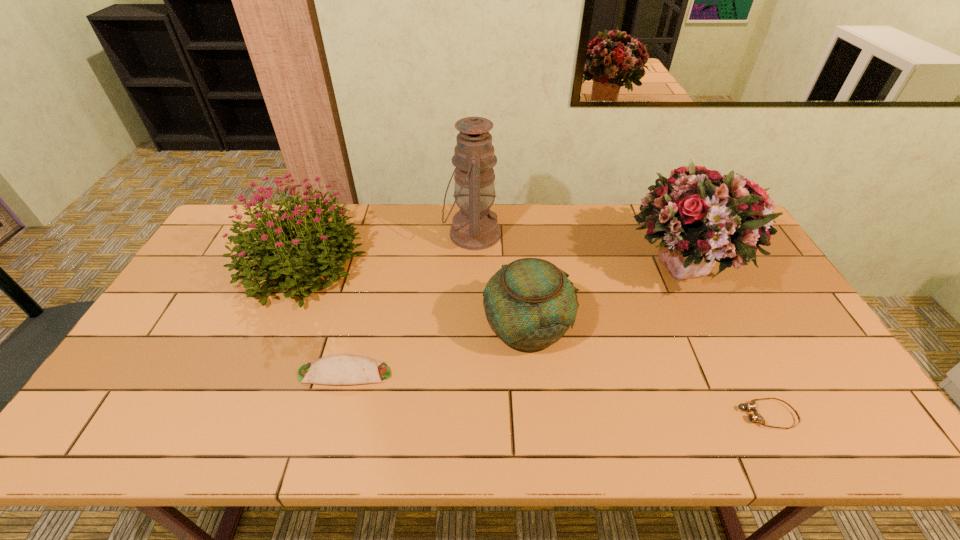
You are a GUI agent. You are given a task and a screenshot of the screen. Output one action in this format:
    pyautogui.click(x=<x>, y=<y>)
    Task: Click on the blank space located on the right of the pottery
    
    Given the screenshot: What is the action you would take?
    pyautogui.click(x=613, y=327)

Find the location of a particular element. free space located at the bitten end of the second shortest object is located at coordinates (511, 373).

Image resolution: width=960 pixels, height=540 pixels. Identify the location of free space located 0.060m on the front lenses and sides of the goggles. (713, 415).

I want to click on free space located 0.080m on the front lenses and sides of the goggles, so click(705, 415).

Image resolution: width=960 pixels, height=540 pixels. In order to click on free point located 0.400m on the front lenses and sides of the goggles in this screenshot , I will do `click(567, 415)`.

Identify the location of oil lamp that is positioned at the far edge. (474, 227).

Find the location of a particular element. The height and width of the screenshot is (540, 960). object present at the near edge is located at coordinates (751, 406).

The width and height of the screenshot is (960, 540). I want to click on object at the left edge, so click(269, 240).

The image size is (960, 540). What are the coordinates of `bouquet that is at the right edge` in the screenshot? It's located at (702, 216).

You are a GUI agent. You are given a task and a screenshot of the screen. Output one action in this format:
    pyautogui.click(x=<x>, y=<y>)
    Task: Click on the goggles that is positioned at the right edge
    
    Given the screenshot: What is the action you would take?
    pyautogui.click(x=751, y=406)